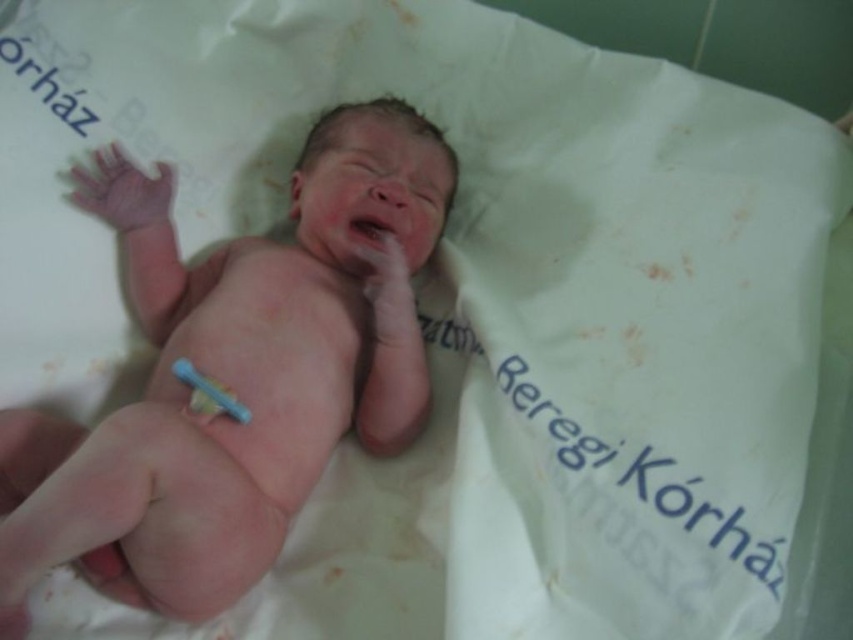
This screenshot has height=640, width=853. What are the coordinates of `pink smooth flesh at center` in the screenshot? It's located at click(370, 228).

Is point (380, 225) more distant than point (210, 387)?

That is True.

This screenshot has height=640, width=853. I want to click on pink smooth flesh at center, so click(x=370, y=228).

How far apart are pink smooth skin at center and blue plastic toothbrush at lower center?

pink smooth skin at center is 6.74 inches from blue plastic toothbrush at lower center.

Does pink smooth skin at center have a greater height compared to blue plastic toothbrush at lower center?

Indeed, pink smooth skin at center has a greater height compared to blue plastic toothbrush at lower center.

Which is in front, point (192, 433) or point (183, 378)?

Positioned in front is point (192, 433).

The width and height of the screenshot is (853, 640). Find the location of `pink smooth skin at center`. pink smooth skin at center is located at coordinates (233, 376).

Can you confirm if pink smooth skin at center is thinner than pink smooth flesh at center?

No.

Find the location of a particular element. This screenshot has width=853, height=640. pink smooth skin at center is located at coordinates (233, 376).